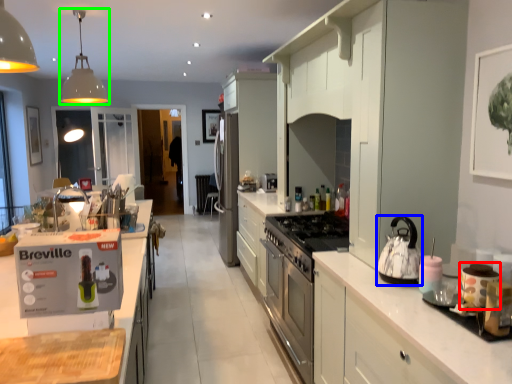
Question: Which object is the closest to the appliance (highlighted by a red box)? Choose among these: kitchen appliance (highlighted by a blue box) or light fixture (highlighted by a green box).

Choices:
 (A) kitchen appliance
 (B) light fixture

Answer: (A)